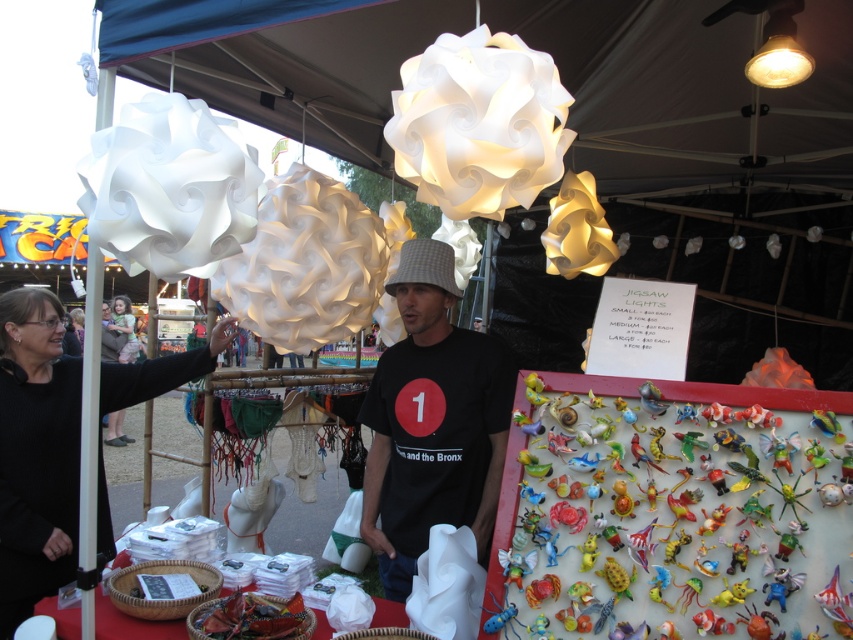
What is the spatial relationship between the white matte paper lantern at upper center and the matte white bulb at upper right in the vendor stall?

The white matte paper lantern at upper center is to the left of the matte white bulb at upper right.

You are a customer at the market who wants to take a photo of the white paper lampshades at upper center. You have a camera that requires a minimum distance of 5 feet to focus properly. Can you stand where the camera is positioned and take a clear photo?

The white paper lampshades at upper center and the camera are 6.84 feet apart, which is more than the 5 feet minimum required for the camera to focus. Therefore, you can take a clear photo from the camera position.